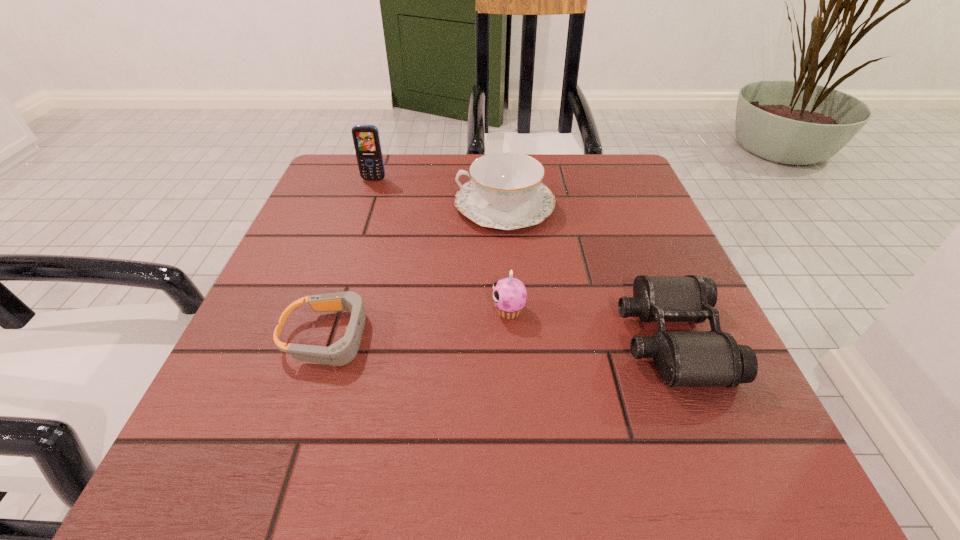
At what (x,y) coordinates should I click in order to perform the action: click on free region located on the handle side of the chinaware. Please return your answer as a coordinate pair (x, y). The image size is (960, 540). Looking at the image, I should click on (343, 205).

The height and width of the screenshot is (540, 960). What are the coordinates of `free space located 0.150m on the handle side of the chinaware` in the screenshot? It's located at coord(388,205).

Image resolution: width=960 pixels, height=540 pixels. In order to click on free space located on the handle side of the chinaware in this screenshot , I will do `click(396, 205)`.

Locate an element on the screen. The height and width of the screenshot is (540, 960). blank space located through the eyepieces of the rightmost object is located at coordinates (447, 339).

At what (x,y) coordinates should I click in order to perform the action: click on vacant position located 0.390m through the eyepieces of the rightmost object. Please return your answer as a coordinate pair (x, y). Image resolution: width=960 pixels, height=540 pixels. Looking at the image, I should click on (379, 339).

At what (x,y) coordinates should I click in order to perform the action: click on vacant space located through the eyepieces of the rightmost object. Please return your answer as a coordinate pair (x, y). This screenshot has width=960, height=540. Looking at the image, I should click on (586, 339).

Where is `free space located on the front and back of the shortest object`? Image resolution: width=960 pixels, height=540 pixels. free space located on the front and back of the shortest object is located at coordinates (538, 337).

Identify the location of cellular telephone that is positioned at the far edge. (366, 139).

Find the location of a particular element. chinaware located in the far edge section of the desktop is located at coordinates (505, 191).

This screenshot has width=960, height=540. Find the location of `cellular telephone located at the left edge`. cellular telephone located at the left edge is located at coordinates (366, 139).